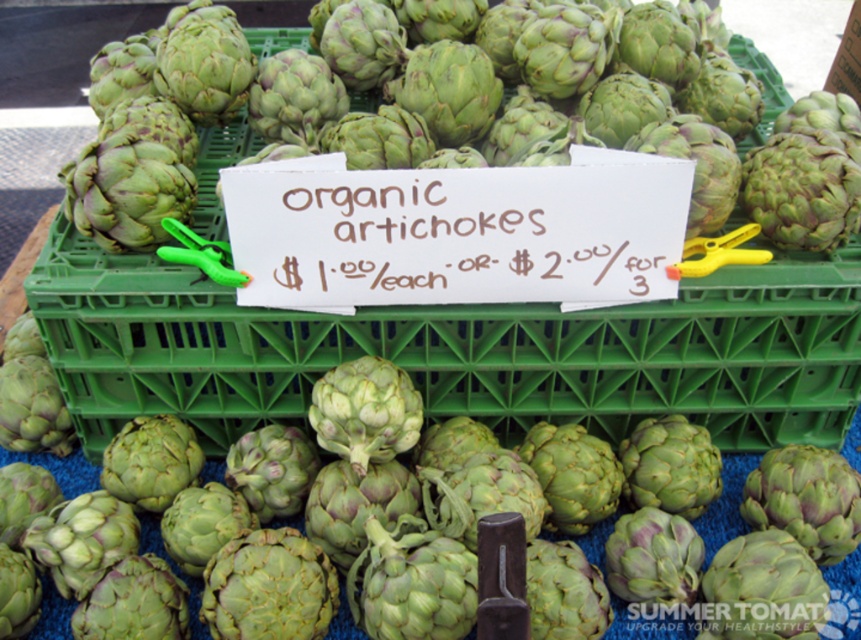
You are at a market stall and see two points marked on the display of organic artichokes. The first point is at coordinate (437, 340) and the second is at (341, 620). From your perspective, which point is closer to you?

Point (341, 620) is closer to you because it is in front of point (437, 340).

You are a customer at the market stall and want to buy artichokes. The sign says you can buy them for a discount if you buy three. Where exactly is the green plastic crate at center located in the image?

The green plastic crate at center is located at point (459, 352) in the image.